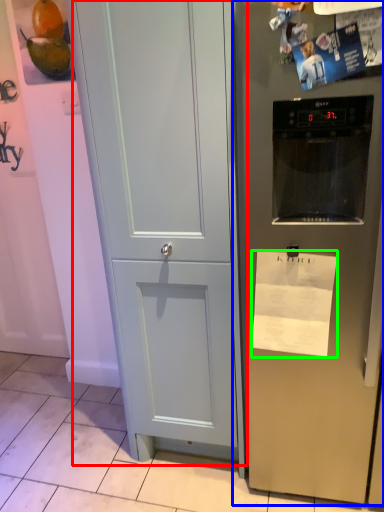
Question: Estimate the real-world distances between objects in this image. Which object is farther from door (highlighted by a red box), refrigerator (highlighted by a blue box) or paper (highlighted by a green box)?

Choices:
 (A) refrigerator
 (B) paper

Answer: (B)